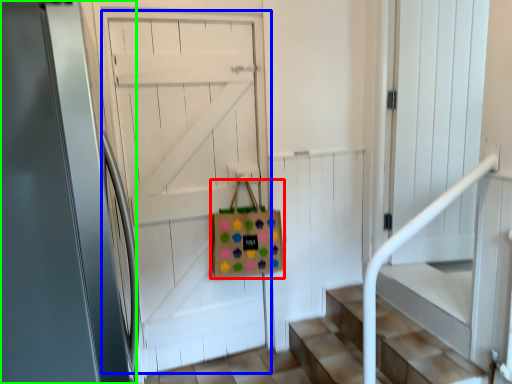
Question: Which object is the closest to the shopping bag (highlighted by a red box)? Choose among these: door (highlighted by a blue box) or door (highlighted by a green box).

Choices:
 (A) door
 (B) door

Answer: (A)